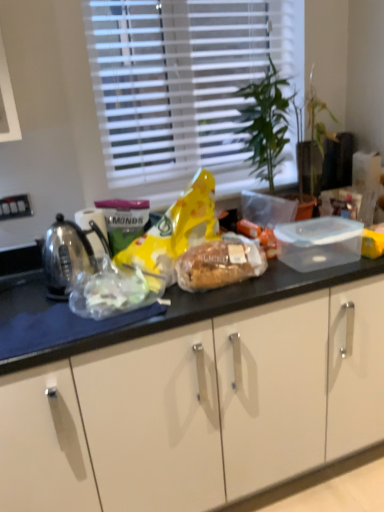
The height and width of the screenshot is (512, 384). What do you see at coordinates (184, 85) in the screenshot?
I see `white blinds at upper center` at bounding box center [184, 85].

What are the coordinates of `translucent plastic bag at left` in the screenshot? It's located at 110,291.

From a real-world perspective, who is located higher, white blinds at upper center or translucent plastic bag at left?

From a 3D spatial view, white blinds at upper center is above.

Is white blinds at upper center far away from translucent plastic bag at left?

white blinds at upper center is near translucent plastic bag at left, not far away.

What's the angular difference between white blinds at upper center and translucent plastic bag at left's facing directions?

The angular difference between white blinds at upper center and translucent plastic bag at left is 11.6 degrees.

Which of these two, white blinds at upper center or translucent plastic bag at left, stands shorter?

Standing shorter between the two is translucent plastic bag at left.

Considering the points (62, 230) and (109, 100), which point is behind, point (62, 230) or point (109, 100)?

The point (109, 100) is more distant.

This screenshot has height=512, width=384. I want to click on kettle below the white blinds at upper center (from a real-world perspective), so coord(68,255).

From a real-world perspective, who is located higher, polished stainless steel kettle at left or white blinds at upper center?

white blinds at upper center is physically above.

Are white blinds at upper center and translucent plastic bread at center making contact?

No, white blinds at upper center is not making contact with translucent plastic bread at center.

Is white blinds at upper center oriented away from translucent plastic bread at center?

No, white blinds at upper center is not facing away from translucent plastic bread at center.

Identify the location of window behind the translucent plastic bread at center. [x=184, y=85].

Considering the relative sizes of white blinds at upper center and translucent plastic bread at center in the image provided, is white blinds at upper center shorter than translucent plastic bread at center?

In fact, white blinds at upper center may be taller than translucent plastic bread at center.

From the image's perspective, is translucent plastic bread at center located above translucent plastic bag at left?

Indeed, from the image's perspective, translucent plastic bread at center is shown above translucent plastic bag at left.

Could you tell me if translucent plastic bread at center is turned towards translucent plastic bag at left?

No.

In terms of size, does translucent plastic bread at center appear bigger or smaller than translucent plastic bag at left?

Clearly, translucent plastic bread at center is larger in size than translucent plastic bag at left.

Does translucent plastic bag at left have a smaller size compared to translucent plastic bread at center?

Yes.

Is translucent plastic bag at left facing away from translucent plastic bread at center?

No, translucent plastic bread at center is not at the back of translucent plastic bag at left.

From the image's perspective, which is above, translucent plastic bag at left or translucent plastic bread at center?

From the image's view, translucent plastic bread at center is above.

Would you say translucent plastic bag at left is to the left or to the right of translucent plastic bread at center in the picture?

translucent plastic bag at left is to the left of translucent plastic bread at center.

Which object is wider, translucent plastic bread at center or polished stainless steel kettle at left?

polished stainless steel kettle at left is wider.

Can you tell me how much translucent plastic bread at center and polished stainless steel kettle at left differ in facing direction?

The facing directions of translucent plastic bread at center and polished stainless steel kettle at left are 6.17 degrees apart.

Between translucent plastic bread at center and polished stainless steel kettle at left, which one has more height?

polished stainless steel kettle at left.

Which is more to the left, translucent plastic bread at center or polished stainless steel kettle at left?

polished stainless steel kettle at left.

From the image's perspective, which is below, polished stainless steel kettle at left or translucent plastic bread at center?

translucent plastic bread at center is shown below in the image.

Is polished stainless steel kettle at left positioned beyond the bounds of translucent plastic bread at center?

Absolutely, polished stainless steel kettle at left is external to translucent plastic bread at center.

From a real-world perspective, is polished stainless steel kettle at left below translucent plastic bread at center?

Incorrect, from a real-world perspective, polished stainless steel kettle at left is higher than translucent plastic bread at center.

Which of these two, polished stainless steel kettle at left or translucent plastic bread at center, is bigger?

polished stainless steel kettle at left.

This screenshot has height=512, width=384. In the image, there is a white blinds at upper center. In order to click on food below it (from a real-world perspective) in this screenshot , I will do `click(110, 291)`.

Where is `window lying above the polished stainless steel kettle at left (from the image's perspective)`? Image resolution: width=384 pixels, height=512 pixels. window lying above the polished stainless steel kettle at left (from the image's perspective) is located at coordinates (184, 85).

From the image, which object appears to be farther from translucent plastic bread at center, translucent plastic bag at left or white blinds at upper center?

Based on the image, white blinds at upper center appears to be further to translucent plastic bread at center.

Which object lies nearer to the anchor point translucent plastic bread at center, white blinds at upper center or polished stainless steel kettle at left?

Among the two, polished stainless steel kettle at left is located nearer to translucent plastic bread at center.

From the picture: Which object lies further to the anchor point white blinds at upper center, translucent plastic bag at left or polished stainless steel kettle at left?

The object further to white blinds at upper center is translucent plastic bag at left.

When comparing their distances from translucent plastic bread at center, does translucent plastic bag at left or polished stainless steel kettle at left seem further?

polished stainless steel kettle at left is positioned further to the anchor translucent plastic bread at center.

Estimate the real-world distances between objects in this image. Which object is further from translucent plastic bag at left, translucent plastic bread at center or white blinds at upper center?

white blinds at upper center lies further to translucent plastic bag at left than the other object.

From the picture: Looking at the image, which one is located closer to translucent plastic bag at left, translucent plastic bread at center or polished stainless steel kettle at left?

polished stainless steel kettle at left.

Which object lies further to the anchor point polished stainless steel kettle at left, translucent plastic bag at left or white blinds at upper center?

white blinds at upper center.

Which object lies nearer to the anchor point translucent plastic bag at left, polished stainless steel kettle at left or translucent plastic bread at center?

Among the two, polished stainless steel kettle at left is located nearer to translucent plastic bag at left.

Identify the location of food between polished stainless steel kettle at left and translucent plastic bread at center. (110, 291).

This screenshot has height=512, width=384. Identify the location of snack between white blinds at upper center and translucent plastic bag at left from top to bottom. (219, 264).

Identify the location of kettle between white blinds at upper center and translucent plastic bread at center from top to bottom. The height and width of the screenshot is (512, 384). (68, 255).

In order to click on kettle that lies between white blinds at upper center and translucent plastic bag at left from top to bottom in this screenshot , I will do `click(68, 255)`.